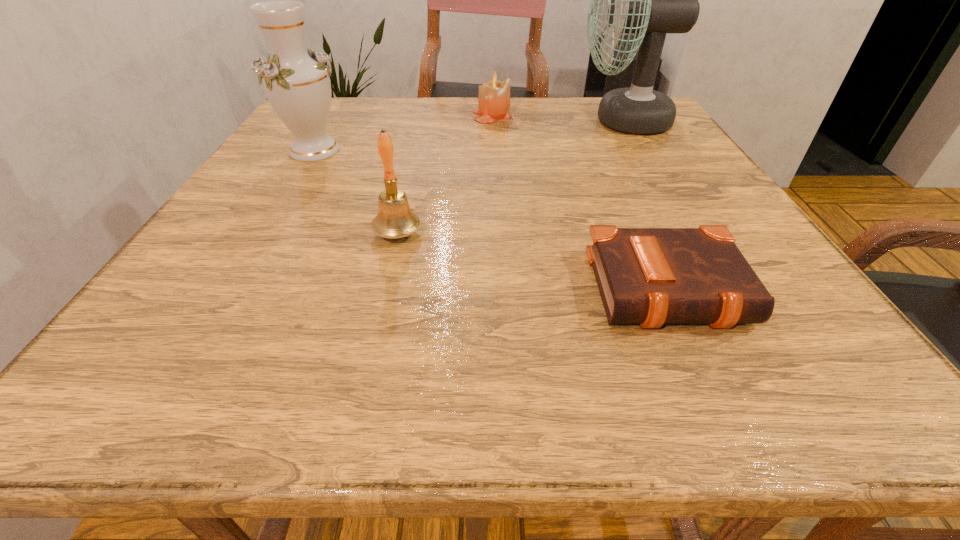
Where is `object located at the far right corner`? The height and width of the screenshot is (540, 960). object located at the far right corner is located at coordinates (649, 0).

The height and width of the screenshot is (540, 960). What are the coordinates of `vacant space at the far edge of the desktop` in the screenshot? It's located at (578, 111).

Find the location of a particular element. vacant area at the near edge of the desktop is located at coordinates (548, 395).

Locate an element on the screen. This screenshot has width=960, height=540. vacant region at the left edge of the desktop is located at coordinates (228, 209).

Identify the location of vacant space at the right edge of the desktop. (679, 165).

In the image, there is a desktop. At what (x,y) coordinates should I click in order to perform the action: click on vacant space at the far left corner. Please return your answer as a coordinate pair (x, y). Looking at the image, I should click on (336, 112).

This screenshot has height=540, width=960. I want to click on free space at the near right corner of the desktop, so click(777, 351).

Where is `free space between the Bible and the bell`? This screenshot has width=960, height=540. free space between the Bible and the bell is located at coordinates (536, 262).

Where is `vacant area between the shortest object and the leftmost object`? The height and width of the screenshot is (540, 960). vacant area between the shortest object and the leftmost object is located at coordinates (493, 220).

Find the location of a particular element. free space between the shortest object and the third object from right to left is located at coordinates (583, 202).